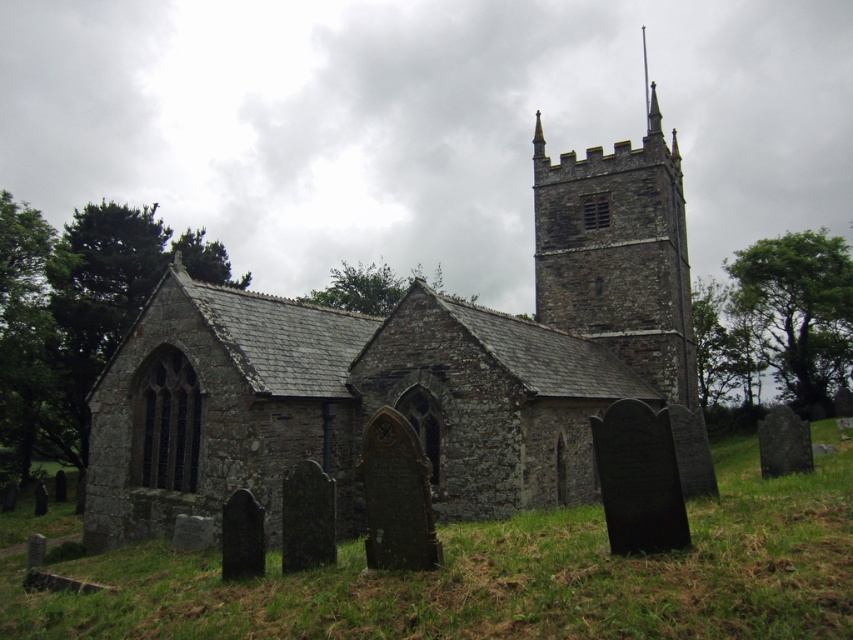
Question: Which of the following is the closest to the observer?

Choices:
 (A) stone church at center
 (B) rustic stone tower at upper center

Answer: (A)

Question: Can you confirm if green grass at lower center is wider than rustic stone tower at upper center?

Choices:
 (A) yes
 (B) no

Answer: (A)

Question: Which of the following is the farthest from the observer?

Choices:
 (A) (728, 492)
 (B) (697, 422)

Answer: (A)

Question: In this image, where is stone church at center located relative to green grass at lower center?

Choices:
 (A) right
 (B) left

Answer: (A)

Question: Which is nearer to the green grass at lower center?

Choices:
 (A) rustic stone tower at upper center
 (B) stone church at center

Answer: (B)

Question: Can you confirm if stone church at center is smaller than rustic stone tower at upper center?

Choices:
 (A) no
 (B) yes

Answer: (B)